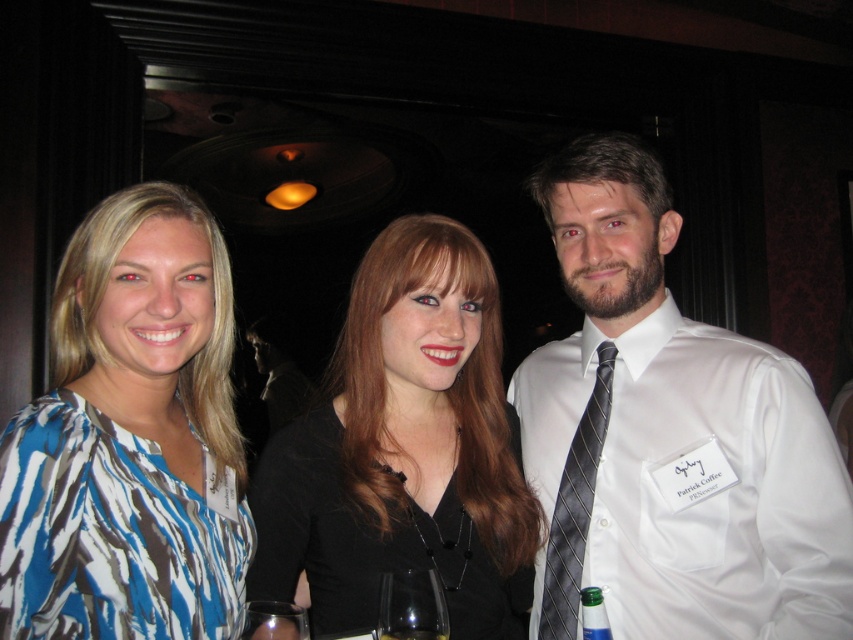
You are standing in a dimly lit room with three people. You notice two points marked in the scene. Which point is closer to you, point (427, 573) or point (294, 627)?

Point (427, 573) is closer to you because it is further to the viewer than point (294, 627).

You are a waiter in a restaurant and need to place two clear glass wine glasses on the table. The table has limited space between the two existing glasses. The two glasses are the clear glass wine glass at center and the clear glass wine glass at lower center. What is the minimum distance you should leave between the new glasses to ensure they don not touch each other?

The minimum distance you should leave between the new glasses to ensure they do not touch each other is 9.81 centimeters, as the existing clear glass wine glass at center and clear glass wine glass at lower center are already 9.81 centimeters apart.